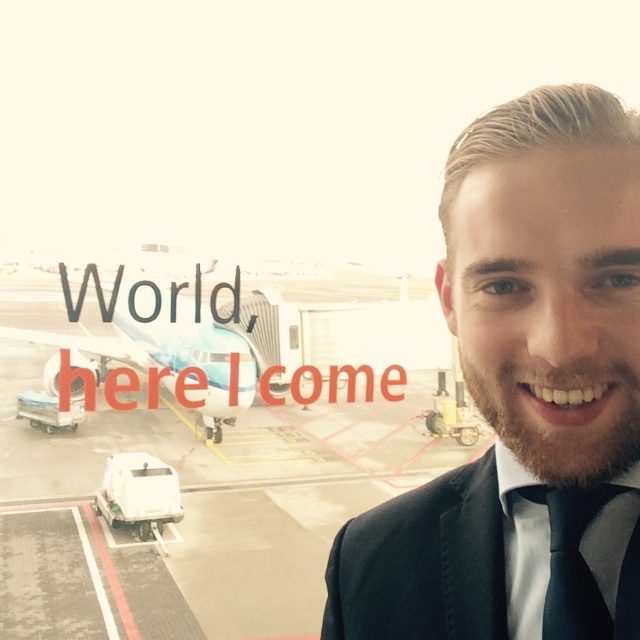
Measure the distance between black suit at center and black satin business suit at right.

black suit at center and black satin business suit at right are 9.86 inches apart.

Between point (504, 316) and point (428, 630), which one is positioned behind?

Positioned behind is point (428, 630).

Which is in front, point (584, 380) or point (337, 586)?

Point (584, 380)

Identify the location of black suit at center. (524, 390).

Does black suit at center appear under light blue metallic airplane at left?

Yes, black suit at center is below light blue metallic airplane at left.

Does point (499, 403) come closer to viewer compared to point (248, 348)?

Yes, it is in front of point (248, 348).

Which is behind, point (573, 435) or point (173, 328)?

Point (173, 328)

The height and width of the screenshot is (640, 640). I want to click on black suit at center, so click(524, 390).

Does black satin business suit at right appear on the left side of black silk tie at right?

Correct, you'll find black satin business suit at right to the left of black silk tie at right.

Does black satin business suit at right have a greater width compared to black silk tie at right?

Correct, the width of black satin business suit at right exceeds that of black silk tie at right.

Which is behind, point (449, 637) or point (586, 620)?

The point (449, 637) is more distant.

Locate an element on the screen. black satin business suit at right is located at coordinates (422, 563).